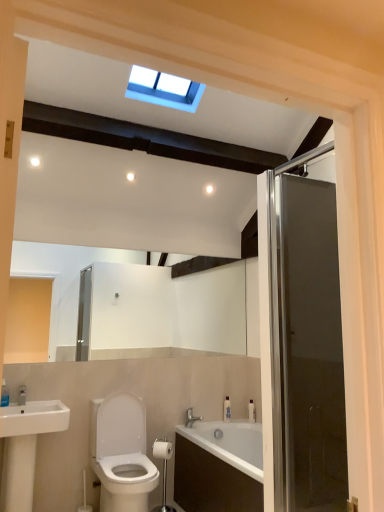
Image resolution: width=384 pixels, height=512 pixels. I want to click on silver metallic faucet at lower center, so click(191, 418).

Describe the element at coordinates (252, 411) in the screenshot. The width and height of the screenshot is (384, 512). I see `white plastic bottle at right, placed as the first toiletry when sorted from right to left` at that location.

Describe the element at coordinates (227, 409) in the screenshot. I see `white glossy bottle at lower center, acting as the 2th toiletry starting from the right` at that location.

Where is `white glossy bottle at lower center, positioned as the first toiletry in left-to-right order`? This screenshot has width=384, height=512. white glossy bottle at lower center, positioned as the first toiletry in left-to-right order is located at coordinates (227, 409).

This screenshot has height=512, width=384. I want to click on silver metallic faucet at lower center, so click(191, 418).

In the scene shown: Does transparent glass door at right have a larger size compared to silver metallic faucet at lower center?

Yes, transparent glass door at right is bigger than silver metallic faucet at lower center.

How many degrees apart are the facing directions of transparent glass door at right and silver metallic faucet at lower center?

The angle between the facing direction of transparent glass door at right and the facing direction of silver metallic faucet at lower center is 90.8 degrees.

From a real-world perspective, which is physically below, transparent glass door at right or silver metallic faucet at lower center?

silver metallic faucet at lower center.

Measure the distance from transparent glass door at right to silver metallic faucet at lower center.

The distance of transparent glass door at right from silver metallic faucet at lower center is 1.88 meters.

I want to click on toilet that is below the silver metallic faucet at lower center (from the image's perspective), so click(x=121, y=453).

In the scene shown: Does white glossy toilet at lower left come behind silver metallic faucet at lower center?

No, white glossy toilet at lower left is in front of silver metallic faucet at lower center.

Can you confirm if white glossy toilet at lower left is smaller than silver metallic faucet at lower center?

No, white glossy toilet at lower left is not smaller than silver metallic faucet at lower center.

Is silver metallic toilet paper holder at lower center, marked as the first towel bar in a top-to-bottom arrangement, positioned with its back to silver metallic faucet at lower center?

Yes.

Which of these two, silver metallic toilet paper holder at lower center, marked as the first towel bar in a top-to-bottom arrangement, or silver metallic faucet at lower center, is smaller?

With smaller size is silver metallic faucet at lower center.

Can we say silver metallic toilet paper holder at lower center, the second towel bar positioned from the bottom, lies outside silver metallic faucet at lower center?

Yes.

Is silver metallic toilet paper holder at lower center, marked as the first towel bar in a top-to-bottom arrangement, shorter than silver metallic faucet at lower center?

Yes, silver metallic toilet paper holder at lower center, marked as the first towel bar in a top-to-bottom arrangement, is shorter than silver metallic faucet at lower center.

From the image's perspective, count 2nd toiletrys upward from the white plastic toilet paper holder at lower center, arranged as the first towel bar when ordered from the bottom, and point to it. Please provide its 2D coordinates.

[(227, 409)]

Considering the sizes of white glossy bottle at lower center, acting as the 2th toiletry starting from the right, and white plastic toilet paper holder at lower center, arranged as the first towel bar when ordered from the bottom, in the image, is white glossy bottle at lower center, acting as the 2th toiletry starting from the right, taller or shorter than white plastic toilet paper holder at lower center, arranged as the first towel bar when ordered from the bottom,?

In the image, white glossy bottle at lower center, acting as the 2th toiletry starting from the right, appears to be shorter than white plastic toilet paper holder at lower center, arranged as the first towel bar when ordered from the bottom.

Is point (229, 416) farther from viewer compared to point (168, 442)?

Yes, point (229, 416) is farther from viewer.

Does white glossy bottle at lower center, positioned as the first toiletry in left-to-right order, lie behind white plastic toilet paper holder at lower center, arranged as the first towel bar when ordered from the bottom?

Yes.

Based on the photo, can you confirm if white plastic toilet paper holder at lower center, the 2th towel bar when ordered from top to bottom, is wider than silver metallic toilet paper holder at lower center, marked as the first towel bar in a top-to-bottom arrangement?

Yes.

Locate an element on the screen. This screenshot has height=512, width=384. towel bar behind the white plastic toilet paper holder at lower center, the 2th towel bar when ordered from top to bottom is located at coordinates (162, 449).

Is white plastic toilet paper holder at lower center, arranged as the first towel bar when ordered from the bottom, touching silver metallic toilet paper holder at lower center, the second towel bar positioned from the bottom?

Yes, white plastic toilet paper holder at lower center, arranged as the first towel bar when ordered from the bottom, is touching silver metallic toilet paper holder at lower center, the second towel bar positioned from the bottom.

Is transparent glass door at right with white plastic bottle at right, placed as the first toiletry when sorted from right to left?

No, transparent glass door at right is not next to white plastic bottle at right, placed as the first toiletry when sorted from right to left.

Looking at this image, between transparent glass door at right and white plastic bottle at right, the 2th toiletry viewed from the left, which one has larger size?

transparent glass door at right.

Considering the positions of objects transparent glass door at right and white plastic bottle at right, placed as the first toiletry when sorted from right to left, in the image provided, who is more to the left, transparent glass door at right or white plastic bottle at right, placed as the first toiletry when sorted from right to left,?

white plastic bottle at right, placed as the first toiletry when sorted from right to left.

Does transparent glass door at right contain white plastic bottle at right, placed as the first toiletry when sorted from right to left?

No, transparent glass door at right does not contain white plastic bottle at right, placed as the first toiletry when sorted from right to left.

Locate an element on the screen. The height and width of the screenshot is (512, 384). tap above the white glossy bottle at lower center, acting as the 2th toiletry starting from the right (from the image's perspective) is located at coordinates (191, 418).

In the scene shown: Is white glossy bottle at lower center, acting as the 2th toiletry starting from the right, wider or thinner than silver metallic faucet at lower center?

In the image, white glossy bottle at lower center, acting as the 2th toiletry starting from the right, appears to be more narrow than silver metallic faucet at lower center.

Which object is positioned more to the left, white glossy bottle at lower center, acting as the 2th toiletry starting from the right, or silver metallic faucet at lower center?

silver metallic faucet at lower center is more to the left.

Identify the location of tap that appears on the left of transparent glass door at right. This screenshot has height=512, width=384. (191, 418).

Where is `tap lying above the white glossy toilet at lower left (from the image's perspective)`? tap lying above the white glossy toilet at lower left (from the image's perspective) is located at coordinates (191, 418).

When comparing their distances from white plastic toilet paper holder at lower center, arranged as the first towel bar when ordered from the bottom, does silver metallic toilet paper holder at lower center, marked as the first towel bar in a top-to-bottom arrangement, or white glossy toilet at lower left seem closer?

silver metallic toilet paper holder at lower center, marked as the first towel bar in a top-to-bottom arrangement, is positioned closer to the anchor white plastic toilet paper holder at lower center, arranged as the first towel bar when ordered from the bottom.

From the image, which object appears to be nearer to transparent glass door at right, silver metallic faucet at lower center or white plastic toilet paper holder at lower center, the 2th towel bar when ordered from top to bottom?

white plastic toilet paper holder at lower center, the 2th towel bar when ordered from top to bottom.

When comparing their distances from silver metallic toilet paper holder at lower center, the second towel bar positioned from the bottom, does transparent glass door at right or white plastic toilet paper holder at lower center, arranged as the first towel bar when ordered from the bottom, seem further?

Based on the image, transparent glass door at right appears to be further to silver metallic toilet paper holder at lower center, the second towel bar positioned from the bottom.

Which object lies further to the anchor point white plastic bottle at right, placed as the first toiletry when sorted from right to left, white glossy bottle at lower center, positioned as the first toiletry in left-to-right order, or white glossy sink at lower left?

white glossy sink at lower left is positioned further to the anchor white plastic bottle at right, placed as the first toiletry when sorted from right to left.

Estimate the real-world distances between objects in this image. Which object is closer to white plastic bottle at right, placed as the first toiletry when sorted from right to left, white glossy bottle at lower center, positioned as the first toiletry in left-to-right order, or transparent glass door at right?

Among the two, white glossy bottle at lower center, positioned as the first toiletry in left-to-right order, is located nearer to white plastic bottle at right, placed as the first toiletry when sorted from right to left.

Looking at the image, which one is located closer to silver metallic faucet at lower center, white plastic bottle at right, the 2th toiletry viewed from the left, or white glossy bottle at lower center, positioned as the first toiletry in left-to-right order?

The object closer to silver metallic faucet at lower center is white glossy bottle at lower center, positioned as the first toiletry in left-to-right order.

Looking at the image, which one is located further to silver metallic toilet paper holder at lower center, marked as the first towel bar in a top-to-bottom arrangement, silver metallic faucet at lower center or white glossy bottle at lower center, positioned as the first toiletry in left-to-right order?

Based on the image, white glossy bottle at lower center, positioned as the first toiletry in left-to-right order, appears to be further to silver metallic toilet paper holder at lower center, marked as the first towel bar in a top-to-bottom arrangement.

From the picture: Looking at the image, which one is located further to silver metallic faucet at lower center, transparent glass door at right or white glossy sink at lower left?

transparent glass door at right is positioned further to the anchor silver metallic faucet at lower center.

Where is `toiletry located between white plastic toilet paper holder at lower center, the 2th towel bar when ordered from top to bottom, and white plastic bottle at right, placed as the first toiletry when sorted from right to left, in the depth direction`? This screenshot has width=384, height=512. toiletry located between white plastic toilet paper holder at lower center, the 2th towel bar when ordered from top to bottom, and white plastic bottle at right, placed as the first toiletry when sorted from right to left, in the depth direction is located at coordinates (227, 409).

Where is `tap between white glossy toilet at lower left and white glossy bottle at lower center, positioned as the first toiletry in left-to-right order, from front to back`? This screenshot has width=384, height=512. tap between white glossy toilet at lower left and white glossy bottle at lower center, positioned as the first toiletry in left-to-right order, from front to back is located at coordinates (191, 418).

This screenshot has width=384, height=512. I want to click on towel bar located between white plastic toilet paper holder at lower center, arranged as the first towel bar when ordered from the bottom, and white plastic bottle at right, placed as the first toiletry when sorted from right to left, in the left-right direction, so click(x=162, y=449).

Where is `towel bar between white glossy sink at lower left and silver metallic toilet paper holder at lower center, the second towel bar positioned from the bottom, in the horizontal direction`? The image size is (384, 512). towel bar between white glossy sink at lower left and silver metallic toilet paper holder at lower center, the second towel bar positioned from the bottom, in the horizontal direction is located at coordinates (163, 470).